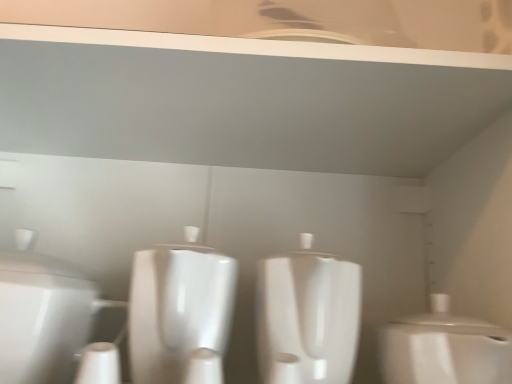
Question: From the image's perspective, is white glossy toilet at center, acting as the 2th toilet starting from the right, positioned above or below white glossy toilet at left, the 1th toilet when ordered from left to right?

Choices:
 (A) above
 (B) below

Answer: (B)

Question: From a real-world perspective, is white glossy toilet at center, acting as the 2th toilet starting from the right, positioned above or below white glossy toilet at left, the third toilet from the right?

Choices:
 (A) above
 (B) below

Answer: (A)

Question: Which object is the closest to the white glossy toilet at left, the third toilet from the right?

Choices:
 (A) white glossy toilet at center, positioned as the second toilet in left-to-right order
 (B) white glossy toilet at right, which is the first toilet from right to left

Answer: (A)

Question: Which of these objects is positioned closest to the white glossy toilet at left, the 1th toilet when ordered from left to right?

Choices:
 (A) white glossy toilet at center, positioned as the second toilet in left-to-right order
 (B) white glossy toilet at right, which is the third toilet from left to right

Answer: (A)